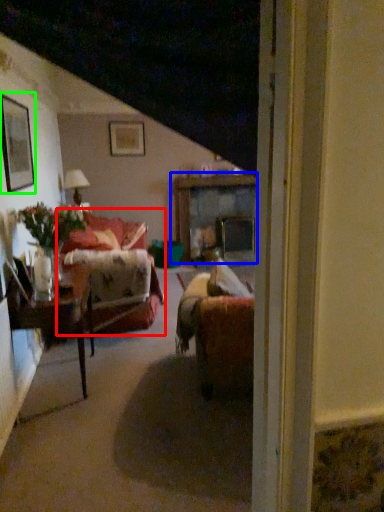
Question: Considering the real-world distances, which object is farthest from studio couch (highlighted by a red box)? table (highlighted by a blue box) or picture frame (highlighted by a green box)?

Choices:
 (A) table
 (B) picture frame

Answer: (A)